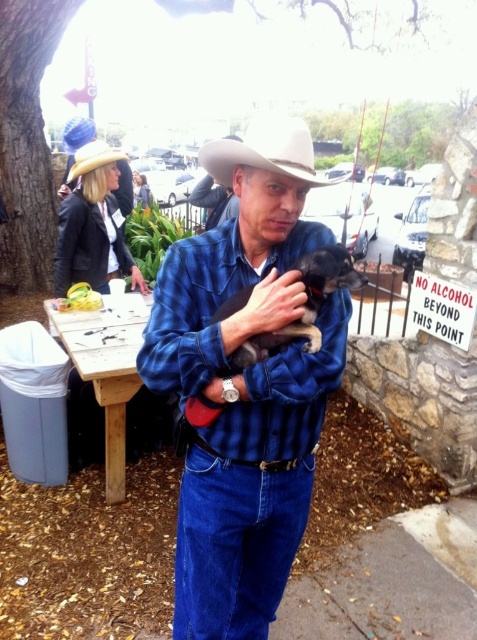
You are standing at the wooden table in the background of the scene. You notice two points marked in the image. Which point, point (241, 301) or point (296, 125), is closer to you?

Point (296, 125) is closer to you because it is in front of point (241, 301) according to their spatial arrangement.

You are standing at the point with coordinates (245, 384). Which object are you closest to in the scene?

The point (245, 384) is on the blue plaid shirt at center, so you are closest to the blue plaid shirt at center.